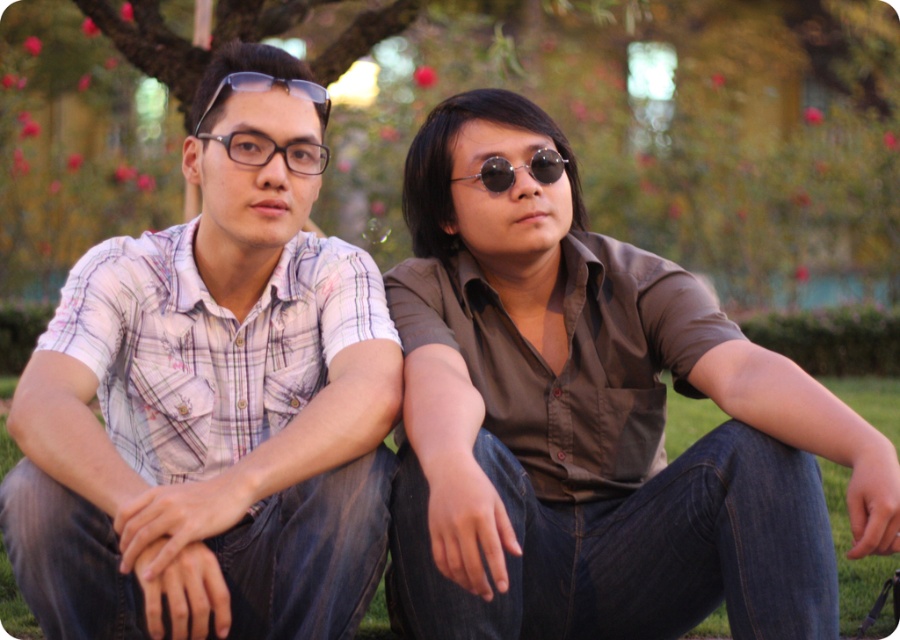
Question: Which of the following is the farthest from the observer?

Choices:
 (A) matte brown shirt at center
 (B) plaid cotton shirt at left

Answer: (A)

Question: Observing the image, what is the correct spatial positioning of matte brown shirt at center in reference to green grass at center?

Choices:
 (A) left
 (B) right

Answer: (A)

Question: Which of the following is the closest to the observer?

Choices:
 (A) sunglasses at center
 (B) matte black glasses at center
 (C) plaid cotton shirt at left
 (D) green grass at center

Answer: (C)

Question: Considering the relative positions of plaid cotton shirt at left and matte black glasses at center in the image provided, where is plaid cotton shirt at left located with respect to matte black glasses at center?

Choices:
 (A) right
 (B) left

Answer: (B)

Question: Is green grass at center below sunglasses at center?

Choices:
 (A) yes
 (B) no

Answer: (A)

Question: Among these points, which one is farthest from the camera?

Choices:
 (A) (306, 161)
 (B) (552, 161)
 (C) (375, 602)
 (D) (399, 504)

Answer: (C)